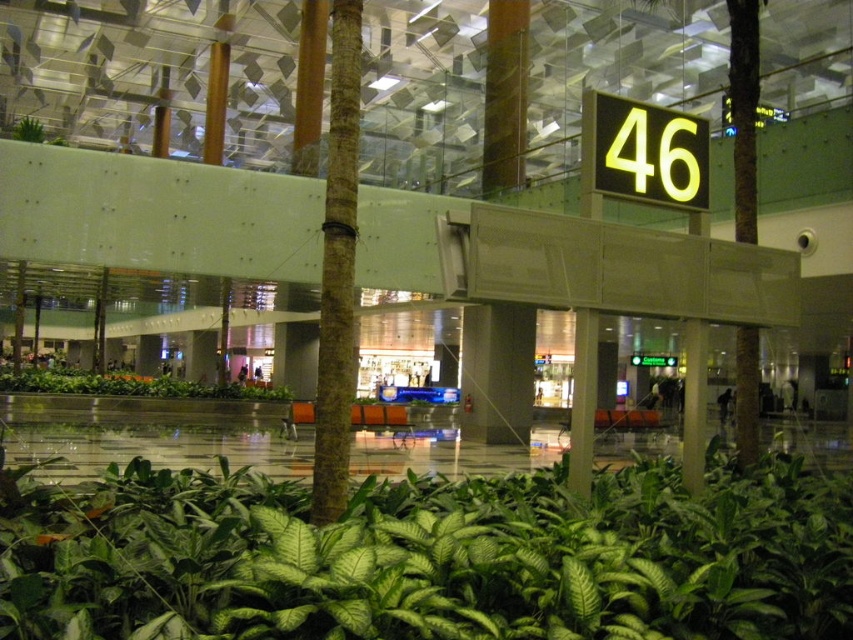
Does brown textured pillar at center appear on the right side of green leafy plants at center?

Correct, you'll find brown textured pillar at center to the right of green leafy plants at center.

What are the coordinates of `brown textured pillar at center` in the screenshot? It's located at (337, 269).

What do you see at coordinates (337, 269) in the screenshot? The width and height of the screenshot is (853, 640). I see `brown textured pillar at center` at bounding box center [337, 269].

Identify the location of brown textured pillar at center. This screenshot has width=853, height=640. (337, 269).

Based on the photo, can you confirm if green leafy plant at center is positioned to the right of green leafy plants at center?

Yes, green leafy plant at center is to the right of green leafy plants at center.

Locate an element on the screen. The width and height of the screenshot is (853, 640). green leafy plant at center is located at coordinates (431, 556).

Is point (668, 484) less distant than point (341, 298)?

That is False.

Does green leafy plant at center have a lesser height compared to brown textured pillar at center?

Yes, green leafy plant at center is shorter than brown textured pillar at center.

Does point (305, 490) come in front of point (354, 29)?

No, it is behind (354, 29).

Image resolution: width=853 pixels, height=640 pixels. I want to click on green leafy plant at center, so click(x=431, y=556).